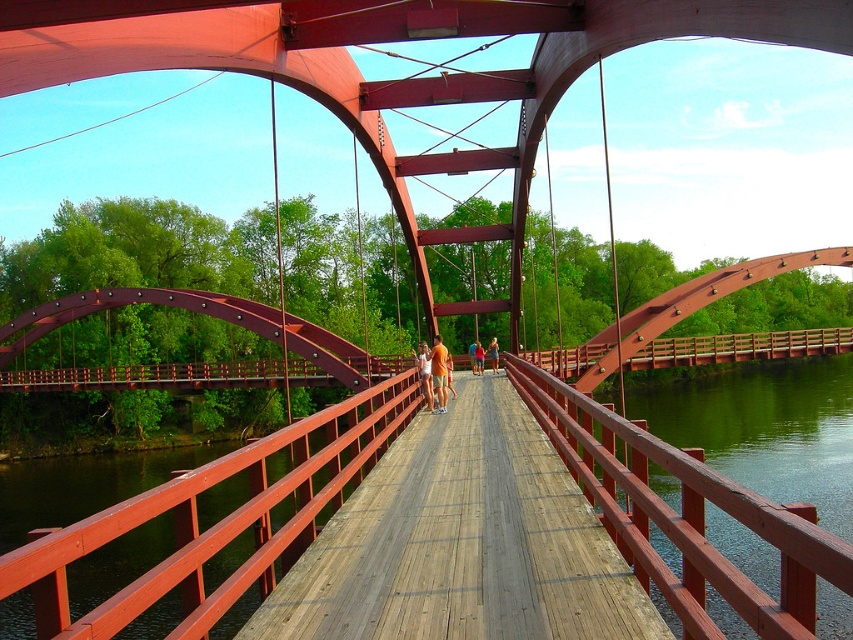
In the scene shown: You are standing on the wooden walkway of the red truss bridge and notice two items at the center of your view. Which one is more to the left? The orange cotton shirt at center or the matte orange shorts at center?

The orange cotton shirt at center is more to the left because it is positioned on the left side of the matte orange shorts at center.